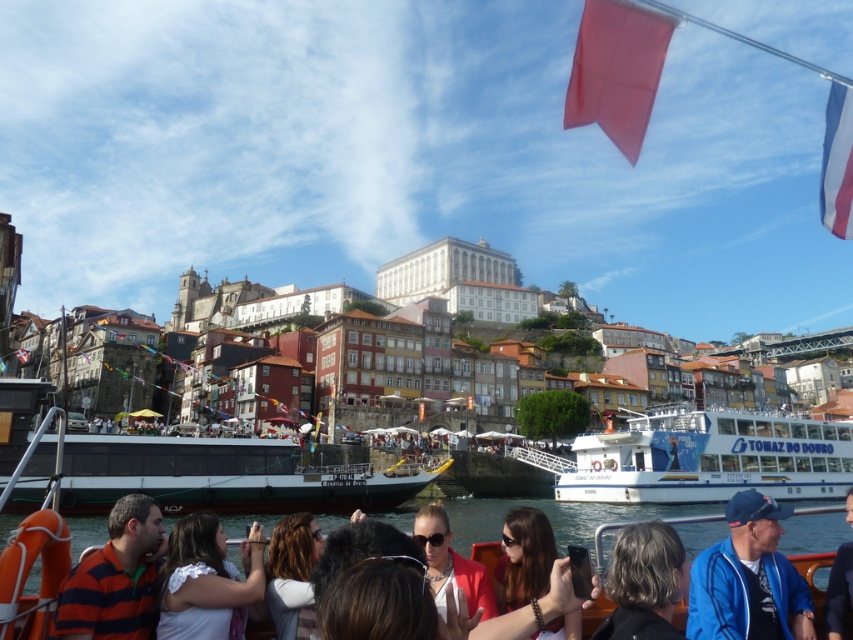
Is green matte boat at center wider than white fabric flag at upper right?

Yes.

Does point (120, 467) come behind point (846, 99)?

Yes, it is behind point (846, 99).

What do you see at coordinates (198, 476) in the screenshot? I see `green matte boat at center` at bounding box center [198, 476].

At what (x,y) coordinates should I click in order to perform the action: click on green matte boat at center. Please return your answer as a coordinate pair (x, y). The width and height of the screenshot is (853, 640). Looking at the image, I should click on (198, 476).

Can you confirm if matte black hair at center is bigger than red fabric flag at upper center?

Yes, matte black hair at center is bigger than red fabric flag at upper center.

The image size is (853, 640). What do you see at coordinates (523, 557) in the screenshot?
I see `matte black hair at center` at bounding box center [523, 557].

Find the location of a particular element. The image size is (853, 640). matte black hair at center is located at coordinates (523, 557).

How far apart are striped cotton shirt at lower left and gray hair at lower center?

They are 86.43 feet apart.

At what (x,y) coordinates should I click in order to perform the action: click on striped cotton shirt at lower left. Please return your answer as a coordinate pair (x, y). Image resolution: width=853 pixels, height=640 pixels. Looking at the image, I should click on (115, 577).

Is point (56, 632) closer to camera compared to point (660, 564)?

Yes, it is in front of point (660, 564).

I want to click on striped cotton shirt at lower left, so click(115, 577).